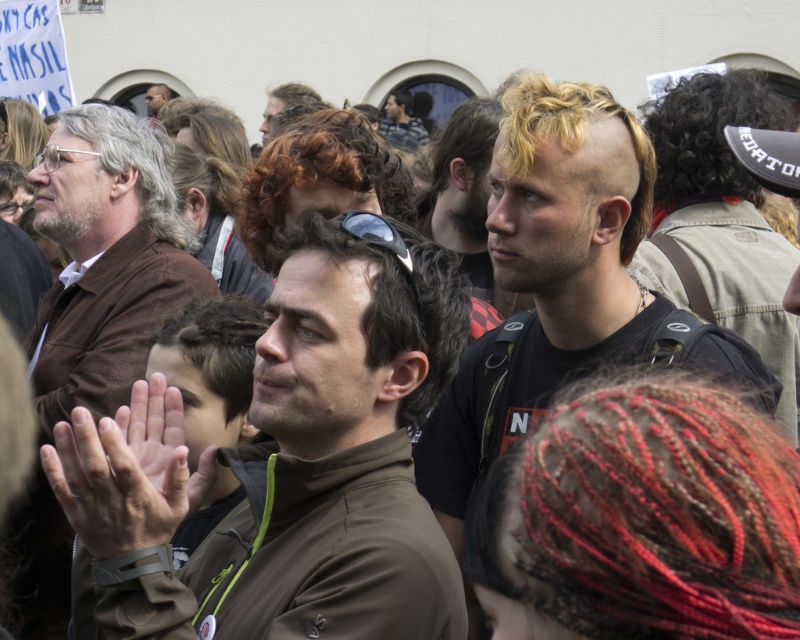
Between brown matte jacket at center and matte black jacket at upper center, which one is positioned higher?

matte black jacket at upper center is higher up.

Is brown matte jacket at center closer to the viewer compared to matte black jacket at upper center?

That is True.

You are a GUI agent. You are given a task and a screenshot of the screen. Output one action in this format:
    pyautogui.click(x=<x>, y=<y>)
    Task: Click on the brown matte jacket at center
    
    Given the screenshot: What is the action you would take?
    pyautogui.click(x=352, y=442)

The width and height of the screenshot is (800, 640). In order to click on matte brown jacket at left in this screenshot , I will do `click(106, 260)`.

Who is taller, brown matte jacket at center or matte brown jacket at left?

matte brown jacket at left is taller.

The width and height of the screenshot is (800, 640). What are the coordinates of `brown matte jacket at center` in the screenshot? It's located at (352, 442).

Image resolution: width=800 pixels, height=640 pixels. Identify the location of brown matte jacket at center. (352, 442).